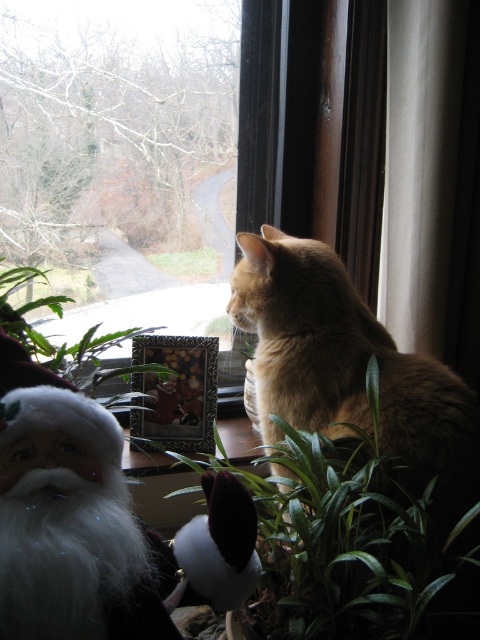
You are a photographer trying to capture the golden fur cat at window and the green leafy plant at lower center in the same frame. Based on their positions, which object should you focus on first to ensure both are in focus?

The golden fur cat at window is located below the green leafy plant at lower center. To ensure both are in focus, you should focus on the green leafy plant at lower center first since it is closer to the camera, allowing the cat behind it to be within the depth of field.

You are trying to take a photo of the golden fur cat at window and the green leafy plant at lower center. To ensure both are in frame, which direction should you move the camera to the left or right?

Since the golden fur cat at window is to the right of green leafy plant at lower center, you should move the camera to the left to ensure both are in frame.